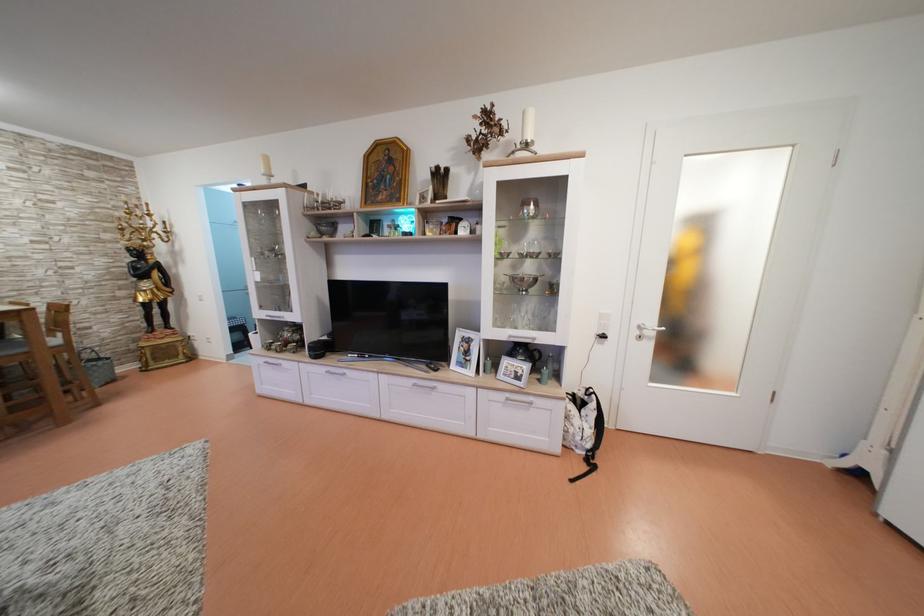
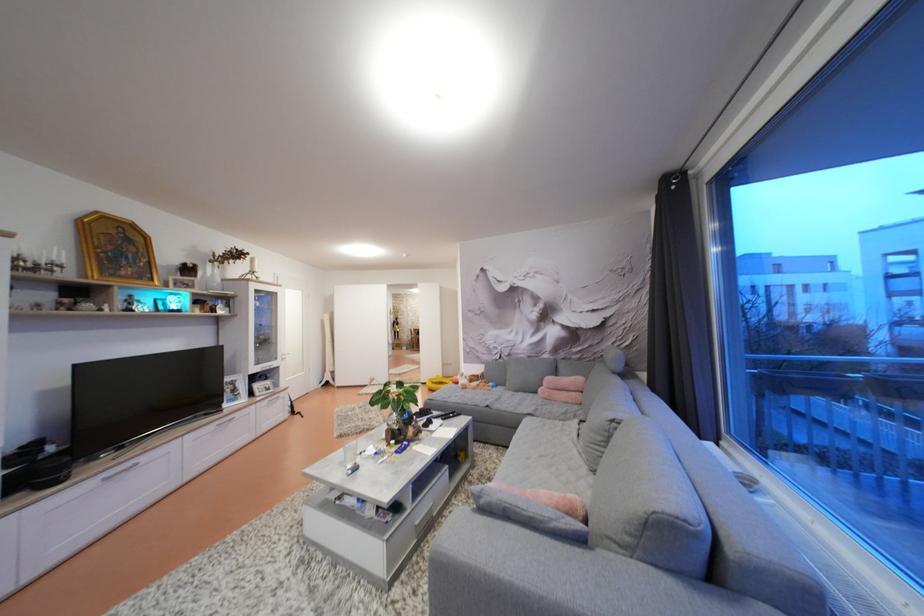
The point at [525,383] is marked in the first image. Where is the corresponding point in the second image?

(274, 394)